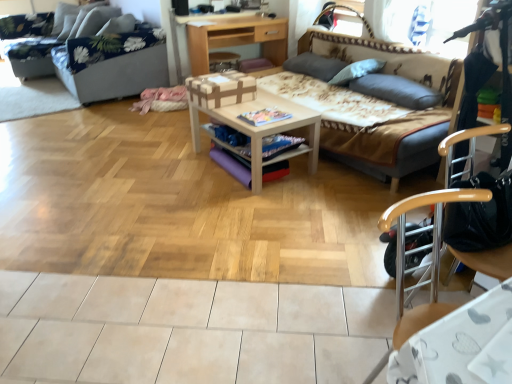
This screenshot has height=384, width=512. Describe the element at coordinates (397, 90) in the screenshot. I see `gray fabric pillow at upper right, marked as the first pillow in a front-to-back arrangement` at that location.

What do you see at coordinates (356, 71) in the screenshot? I see `gray fabric pillow at upper right, marked as the second pillow in a front-to-back arrangement` at bounding box center [356, 71].

Identify the location of white wood table at center. (250, 111).

Is floral fabric studio couch at upper left, arranged as the 2th studio couch when viewed from the right, smaller than wooden desk at center?

Incorrect, floral fabric studio couch at upper left, arranged as the 2th studio couch when viewed from the right, is not smaller in size than wooden desk at center.

From a real-world perspective, is floral fabric studio couch at upper left, arranged as the 2th studio couch when viewed from the right, physically located above or below wooden desk at center?

Clearly, from a real-world perspective, floral fabric studio couch at upper left, arranged as the 2th studio couch when viewed from the right, is below wooden desk at center.

From the picture: From the image's perspective, who appears lower, floral fabric studio couch at upper left, the first studio couch when ordered from left to right, or wooden desk at center?

wooden desk at center.

Which of these two, gray fabric pillow at upper right, the second pillow viewed from the back, or gray fabric pillow at upper right, marked as the first pillow in a front-to-back arrangement, is bigger?

gray fabric pillow at upper right, marked as the first pillow in a front-to-back arrangement, is bigger.

Locate an element on the screen. This screenshot has height=384, width=512. pillow lying on the right of gray fabric pillow at upper right, the second pillow viewed from the back is located at coordinates (x=397, y=90).

Based on the photo, are gray fabric pillow at upper right, marked as the second pillow in a front-to-back arrangement, and gray fabric pillow at upper right, marked as the first pillow in a front-to-back arrangement, located far from each other?

No, gray fabric pillow at upper right, marked as the second pillow in a front-to-back arrangement, is not far away from gray fabric pillow at upper right, marked as the first pillow in a front-to-back arrangement.

How different are the orientations of gray fabric pillow at upper right, marked as the second pillow in a front-to-back arrangement, and gray fabric pillow at upper right, marked as the first pillow in a front-to-back arrangement, in degrees?

There is a 0.000591-degree angle between the facing directions of gray fabric pillow at upper right, marked as the second pillow in a front-to-back arrangement, and gray fabric pillow at upper right, marked as the first pillow in a front-to-back arrangement.

Could you tell me if gray fabric pillow at upper right, placed as the 3th pillow when sorted from back to front, is facing wooden desk at center?

No, gray fabric pillow at upper right, placed as the 3th pillow when sorted from back to front, is not turned towards wooden desk at center.

Can you tell me how much gray fabric pillow at upper right, marked as the first pillow in a front-to-back arrangement, and wooden desk at center differ in facing direction?

87.9 degrees.

Find the location of a particular element. Image resolution: width=512 pixels, height=384 pixels. desk on the left of gray fabric pillow at upper right, marked as the first pillow in a front-to-back arrangement is located at coordinates (234, 37).

In terms of width, does gray fabric pillow at upper right, placed as the 3th pillow when sorted from back to front, look wider or thinner when compared to wooden desk at center?

Clearly, gray fabric pillow at upper right, placed as the 3th pillow when sorted from back to front, has less width compared to wooden desk at center.

Which object is thinner, white wood table at center or gray fabric pillow at upper center, which is the 3th pillow in front-to-back order?

Thinner between the two is gray fabric pillow at upper center, which is the 3th pillow in front-to-back order.

Is the position of white wood table at center more distant than that of gray fabric pillow at upper center, which is the 3th pillow in front-to-back order?

No, the depth of white wood table at center is less than that of gray fabric pillow at upper center, which is the 3th pillow in front-to-back order.

Would you consider white wood table at center to be distant from gray fabric pillow at upper center, which ranks as the first pillow in back-to-front order?

white wood table at center is actually quite close to gray fabric pillow at upper center, which ranks as the first pillow in back-to-front order.

Is white wood table at center aimed at gray fabric pillow at upper center, which is the 3th pillow in front-to-back order?

No, white wood table at center is not turned towards gray fabric pillow at upper center, which is the 3th pillow in front-to-back order.

Can you confirm if gray fabric pillow at upper center, which is the 3th pillow in front-to-back order, is smaller than wooden desk at center?

Yes.

Which of these two, gray fabric pillow at upper center, which is the 3th pillow in front-to-back order, or wooden desk at center, is thinner?

gray fabric pillow at upper center, which is the 3th pillow in front-to-back order.

Considering the positions of objects gray fabric pillow at upper center, which is the 3th pillow in front-to-back order, and wooden desk at center in the image provided, who is more to the right, gray fabric pillow at upper center, which is the 3th pillow in front-to-back order, or wooden desk at center?

gray fabric pillow at upper center, which is the 3th pillow in front-to-back order.

Locate an element on the screen. The image size is (512, 384). the 1st pillow below when counting from the wooden desk at center (from the image's perspective) is located at coordinates (314, 66).

Is wooden desk at center taller than brown fabric studio couch at center, which is the 2th studio couch in left-to-right order?

In fact, wooden desk at center may be shorter than brown fabric studio couch at center, which is the 2th studio couch in left-to-right order.

Does wooden desk at center come in front of brown fabric studio couch at center, the 1th studio couch when ordered from right to left?

No, wooden desk at center is further to the viewer.

Could you tell me if wooden desk at center is facing brown fabric studio couch at center, the 1th studio couch when ordered from right to left?

Yes, wooden desk at center is oriented towards brown fabric studio couch at center, the 1th studio couch when ordered from right to left.

Can you confirm if wooden desk at center is thinner than brown fabric studio couch at center, the 1th studio couch when ordered from right to left?

Yes, wooden desk at center is thinner than brown fabric studio couch at center, the 1th studio couch when ordered from right to left.

Who is taller, floral fabric studio couch at upper left, the first studio couch when ordered from left to right, or gray fabric pillow at upper right, placed as the 3th pillow when sorted from back to front?

floral fabric studio couch at upper left, the first studio couch when ordered from left to right.

From the image's perspective, would you say floral fabric studio couch at upper left, arranged as the 2th studio couch when viewed from the right, is positioned over gray fabric pillow at upper right, placed as the 3th pillow when sorted from back to front?

Yes, from the image's perspective, floral fabric studio couch at upper left, arranged as the 2th studio couch when viewed from the right, is above gray fabric pillow at upper right, placed as the 3th pillow when sorted from back to front.

From a real-world perspective, who is located lower, floral fabric studio couch at upper left, arranged as the 2th studio couch when viewed from the right, or gray fabric pillow at upper right, placed as the 3th pillow when sorted from back to front?

floral fabric studio couch at upper left, arranged as the 2th studio couch when viewed from the right, is physically lower.

Which is more to the right, floral fabric studio couch at upper left, the first studio couch when ordered from left to right, or gray fabric pillow at upper right, marked as the first pillow in a front-to-back arrangement?

From the viewer's perspective, gray fabric pillow at upper right, marked as the first pillow in a front-to-back arrangement, appears more on the right side.

Locate an element on the screen. desk located above the floral fabric studio couch at upper left, the first studio couch when ordered from left to right (from a real-world perspective) is located at coordinates (234, 37).

At what (x,y) coordinates should I click in order to perform the action: click on pillow that is the 2nd object directly below the gray fabric pillow at upper right, the second pillow viewed from the back (from a real-world perspective). Please return your answer as a coordinate pair (x, y). This screenshot has height=384, width=512. Looking at the image, I should click on (397, 90).

Considering their positions, is brown fabric studio couch at center, which is the 2th studio couch in left-to-right order, positioned closer to floral fabric studio couch at upper left, the first studio couch when ordered from left to right, than gray fabric pillow at upper center, which is the 3th pillow in front-to-back order?

gray fabric pillow at upper center, which is the 3th pillow in front-to-back order, is positioned closer to the anchor floral fabric studio couch at upper left, the first studio couch when ordered from left to right.

Considering their positions, is gray fabric pillow at upper right, marked as the first pillow in a front-to-back arrangement, positioned closer to gray fabric pillow at upper right, the second pillow viewed from the back, than floral fabric studio couch at upper left, arranged as the 2th studio couch when viewed from the right?

Based on the image, gray fabric pillow at upper right, marked as the first pillow in a front-to-back arrangement, appears to be nearer to gray fabric pillow at upper right, the second pillow viewed from the back.

From the image, which object appears to be farther from floral fabric studio couch at upper left, arranged as the 2th studio couch when viewed from the right, white wood table at center or wooden desk at center?

Among the two, white wood table at center is located further to floral fabric studio couch at upper left, arranged as the 2th studio couch when viewed from the right.

Consider the image. From the image, which object appears to be farther from brown fabric studio couch at center, which is the 2th studio couch in left-to-right order, floral fabric studio couch at upper left, arranged as the 2th studio couch when viewed from the right, or white wood table at center?

floral fabric studio couch at upper left, arranged as the 2th studio couch when viewed from the right.

Looking at the image, which one is located further to white wood table at center, brown fabric studio couch at center, which is the 2th studio couch in left-to-right order, or gray fabric pillow at upper center, which is the 3th pillow in front-to-back order?

gray fabric pillow at upper center, which is the 3th pillow in front-to-back order, is further to white wood table at center.

Consider the image. Based on their spatial positions, is wooden desk at center or gray fabric pillow at upper center, which ranks as the first pillow in back-to-front order, further from white wood table at center?

wooden desk at center is positioned further to the anchor white wood table at center.

Considering their positions, is gray fabric pillow at upper right, marked as the first pillow in a front-to-back arrangement, positioned further to wooden desk at center than white wood table at center?

gray fabric pillow at upper right, marked as the first pillow in a front-to-back arrangement.

Which object lies nearer to the anchor point gray fabric pillow at upper right, the second pillow viewed from the back, gray fabric pillow at upper right, placed as the 3th pillow when sorted from back to front, or gray fabric pillow at upper center, which ranks as the first pillow in back-to-front order?

gray fabric pillow at upper right, placed as the 3th pillow when sorted from back to front.

At what (x,y) coordinates should I click in order to perform the action: click on table positioned between brown fabric studio couch at center, which is the 2th studio couch in left-to-right order, and wooden desk at center from near to far. Please return your answer as a coordinate pair (x, y). The image size is (512, 384). Looking at the image, I should click on (250, 111).

Where is `table between floral fabric studio couch at upper left, arranged as the 2th studio couch when viewed from the right, and brown fabric studio couch at center, the 1th studio couch when ordered from right to left`? This screenshot has height=384, width=512. table between floral fabric studio couch at upper left, arranged as the 2th studio couch when viewed from the right, and brown fabric studio couch at center, the 1th studio couch when ordered from right to left is located at coordinates (250, 111).

Find the location of a particular element. desk between floral fabric studio couch at upper left, the first studio couch when ordered from left to right, and white wood table at center is located at coordinates (234, 37).

Locate an element on the screen. pillow between wooden desk at center and gray fabric pillow at upper right, the second pillow viewed from the back is located at coordinates (314, 66).